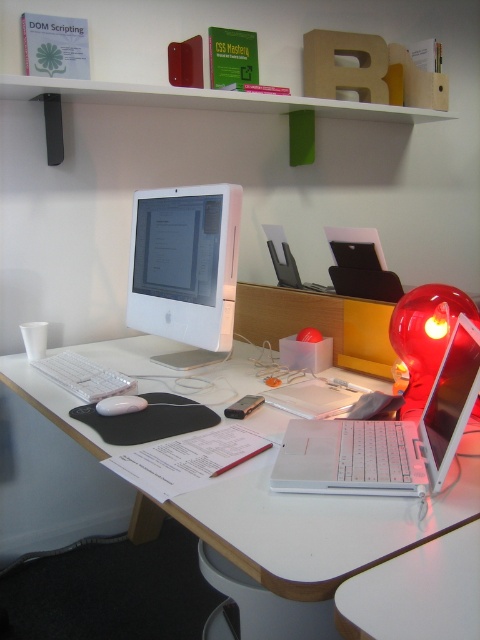
You are standing 5 feet away from the desk. Can you reach the point at coordinates point [226,300] on the desk without moving closer?

The distance of point [226,300] from viewer is 4.90 feet, so yes, you can reach it without moving closer since you are already at 5 feet distance.

You are setting up a new webcam for video calls. The webcam needs to be placed exactly at point (186, 269) to capture the best angle. Which object should you place the webcam on top of?

The white glossy computer monitor at center is located at point (186, 269), so you should place the webcam on top of the white glossy computer monitor at center.

You are a person sitting at the desk and want to reach both the white glossy table at center and the white matte mouse at center. Which object will you need to move your hand forward more to reach?

The white glossy table at center is in front of the white matte mouse at center, so you will need to move your hand forward more to reach the white matte mouse at center because it is further away from you.